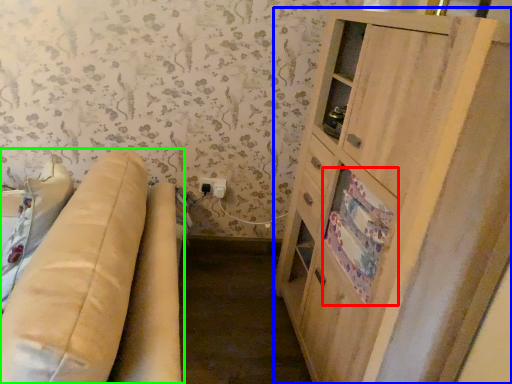
Question: Which object is positioned closest to drawer (highlighted by a red box)? Select from cabinetry (highlighted by a blue box) and studio couch (highlighted by a green box).

Choices:
 (A) cabinetry
 (B) studio couch

Answer: (A)